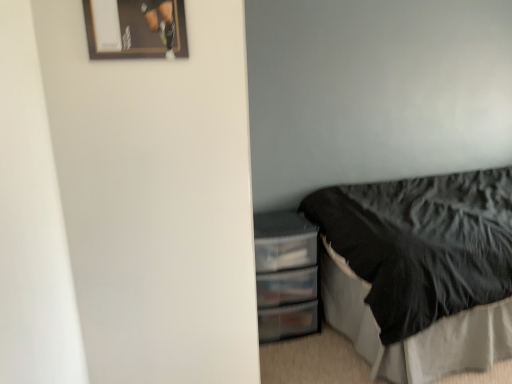
Question: From the image's perspective, is wooden framed poster at upper left located beneath black feathered bed at lower right?

Choices:
 (A) no
 (B) yes

Answer: (A)

Question: Is wooden framed poster at upper left positioned before black feathered bed at lower right?

Choices:
 (A) yes
 (B) no

Answer: (A)

Question: From the image's perspective, is wooden framed poster at upper left on black feathered bed at lower right?

Choices:
 (A) no
 (B) yes

Answer: (B)

Question: Is wooden framed poster at upper left facing away from black feathered bed at lower right?

Choices:
 (A) yes
 (B) no

Answer: (B)

Question: Would you say wooden framed poster at upper left is a long distance from black feathered bed at lower right?

Choices:
 (A) no
 (B) yes

Answer: (B)

Question: Does wooden framed poster at upper left have a lesser height compared to black feathered bed at lower right?

Choices:
 (A) yes
 (B) no

Answer: (A)

Question: Is transparent plastic drawers at lower right smaller than wooden framed poster at upper left?

Choices:
 (A) yes
 (B) no

Answer: (B)

Question: Considering the relative sizes of transparent plastic drawers at lower right and wooden framed poster at upper left in the image provided, is transparent plastic drawers at lower right thinner than wooden framed poster at upper left?

Choices:
 (A) yes
 (B) no

Answer: (B)

Question: Are transparent plastic drawers at lower right and wooden framed poster at upper left beside each other?

Choices:
 (A) no
 (B) yes

Answer: (A)

Question: From the image's perspective, does transparent plastic drawers at lower right appear lower than wooden framed poster at upper left?

Choices:
 (A) no
 (B) yes

Answer: (B)

Question: Does transparent plastic drawers at lower right come behind wooden framed poster at upper left?

Choices:
 (A) no
 (B) yes

Answer: (B)

Question: Does transparent plastic drawers at lower right appear on the left side of wooden framed poster at upper left?

Choices:
 (A) no
 (B) yes

Answer: (A)

Question: Is black feathered bed at lower right far from wooden framed poster at upper left?

Choices:
 (A) yes
 (B) no

Answer: (A)